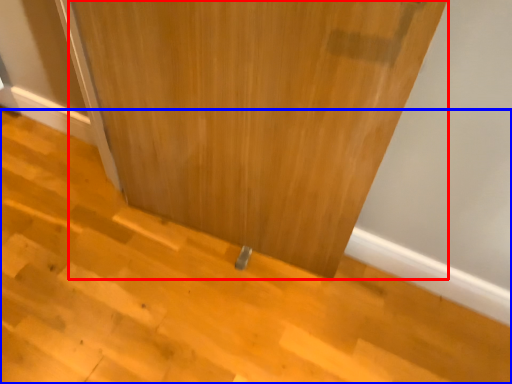
Question: Which object appears farthest to the camera in this image, door (highlighted by a red box) or stair (highlighted by a blue box)?

Choices:
 (A) door
 (B) stair

Answer: (B)